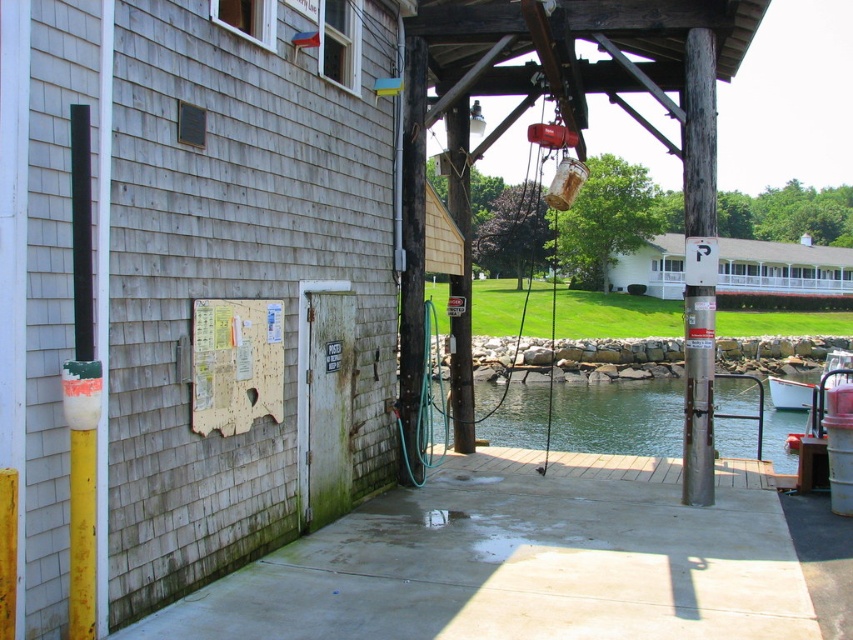
You are a maintenance worker who needs to move the white plastic boat at lower right to the concrete at center. Can you place the boat on the concrete without it hanging over the edge?

The concrete at center is shorter than the white plastic boat at lower right, so placing the boat on the concrete would cause part of it to hang over the edge since the concrete is not long enough to fully support the boat.

You are a maintenance worker at the marina and need to determine which area requires more material for covering. Based on the scene, which object between the concrete at center and the green water at dock center has a larger area?

The green water at dock center has a larger area than the concrete at center since the concrete at center is smaller in size compared to it.